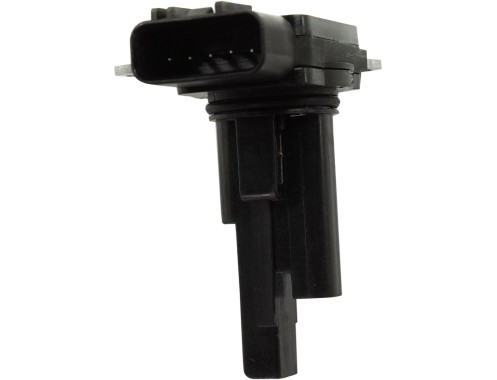
Locate an element on the screen. This screenshot has width=497, height=380. socket is located at coordinates (206, 40).